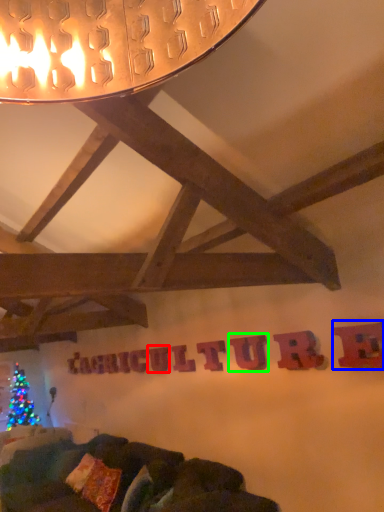
Question: Considering the real-world distances, which object is closest to letter (highlighted by a red box)? letter (highlighted by a blue box) or letter (highlighted by a green box).

Choices:
 (A) letter
 (B) letter

Answer: (B)